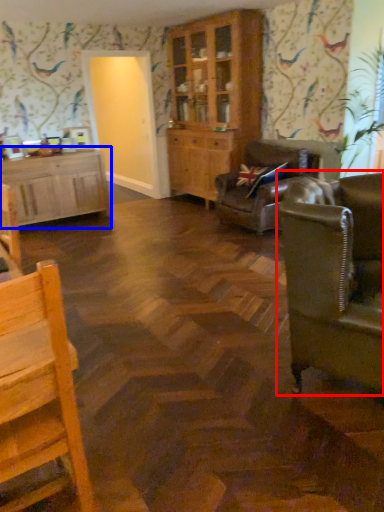
Question: Among these objects, which one is farthest to the camera, studio couch (highlighted by a red box) or cabinetry (highlighted by a blue box)?

Choices:
 (A) studio couch
 (B) cabinetry

Answer: (B)